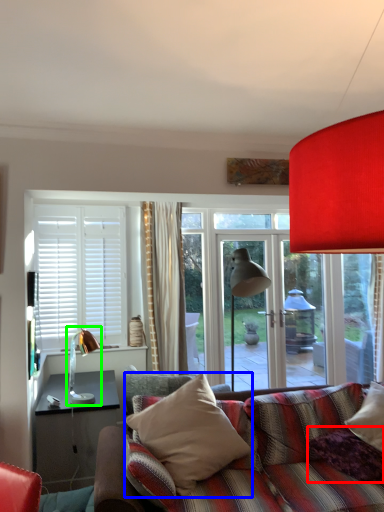
Question: Considering the real-world distances, which object is closest to pillow (highlighted by a red box)? pillow (highlighted by a blue box) or table lamp (highlighted by a green box).

Choices:
 (A) pillow
 (B) table lamp

Answer: (A)